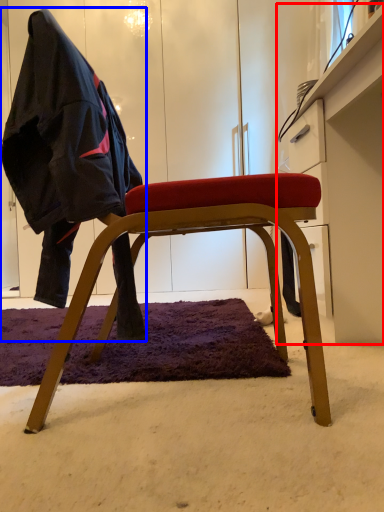
Question: Which point is further to the camera, dresser (highlighted by a red box) or person (highlighted by a blue box)?

Choices:
 (A) dresser
 (B) person

Answer: (A)